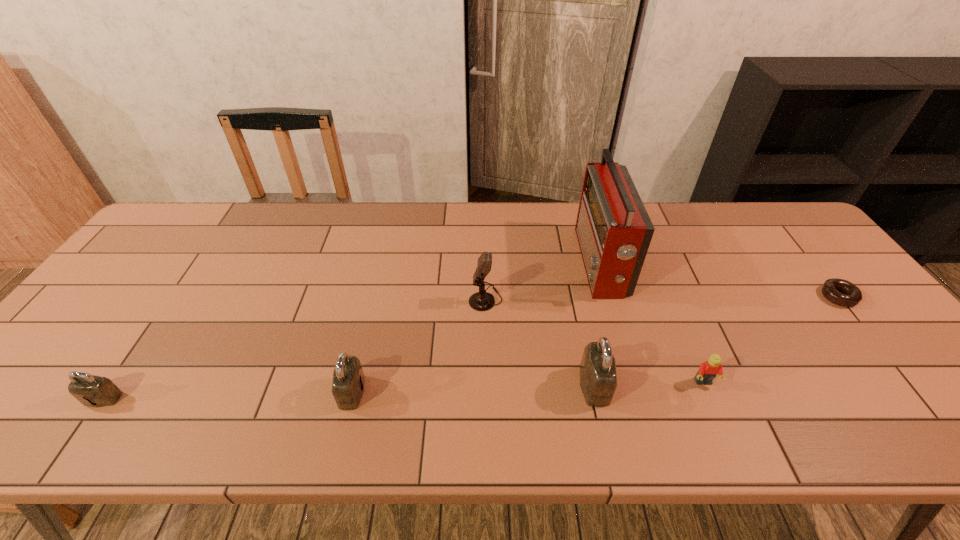
Locate an element on the screen. the leftmost padlock is located at coordinates (96, 391).

The height and width of the screenshot is (540, 960). Identify the location of the leftmost object. (96, 391).

You are a GUI agent. You are given a task and a screenshot of the screen. Output one action in this format:
    pyautogui.click(x=<x>, y=<y>)
    Task: Click on the second shortest padlock
    This screenshot has height=540, width=960.
    Given the screenshot: What is the action you would take?
    pyautogui.click(x=348, y=378)

You are a GUI agent. You are given a task and a screenshot of the screen. Output one action in this format:
    pyautogui.click(x=<x>, y=<y>)
    Task: Click on the fourth tallest object
    The width and height of the screenshot is (960, 540).
    Given the screenshot: What is the action you would take?
    pyautogui.click(x=348, y=378)

Where is `the tallest padlock`? The height and width of the screenshot is (540, 960). the tallest padlock is located at coordinates (598, 380).

The width and height of the screenshot is (960, 540). I want to click on the fourth object from left to right, so click(598, 380).

This screenshot has height=540, width=960. In order to click on radio receiver in this screenshot , I will do `click(613, 229)`.

Where is `the tallest object`? This screenshot has width=960, height=540. the tallest object is located at coordinates (613, 229).

At what (x,y) coordinates should I click in order to perform the action: click on microphone. Please return your answer as a coordinate pair (x, y). The width and height of the screenshot is (960, 540). Looking at the image, I should click on (481, 301).

Where is `the shortest object`? The image size is (960, 540). the shortest object is located at coordinates (852, 295).